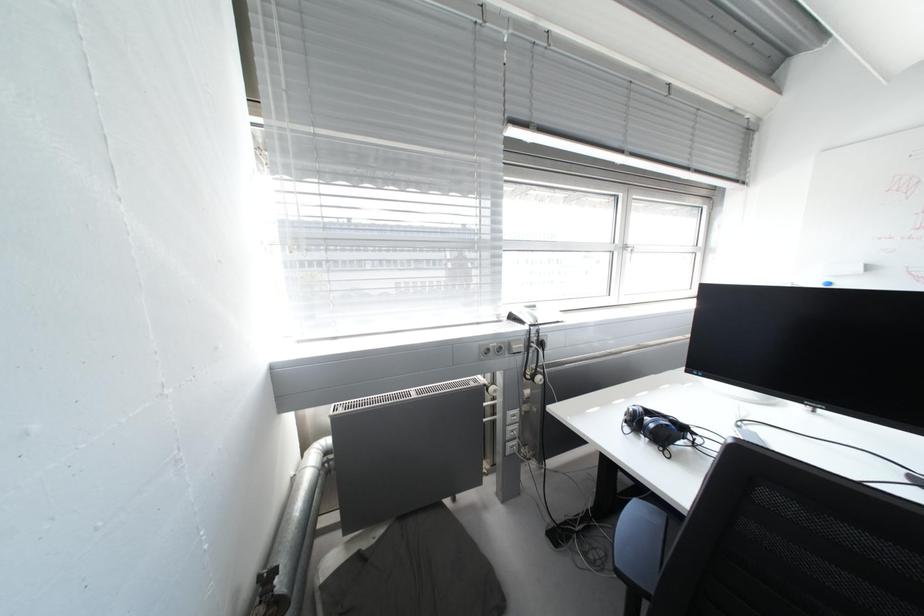
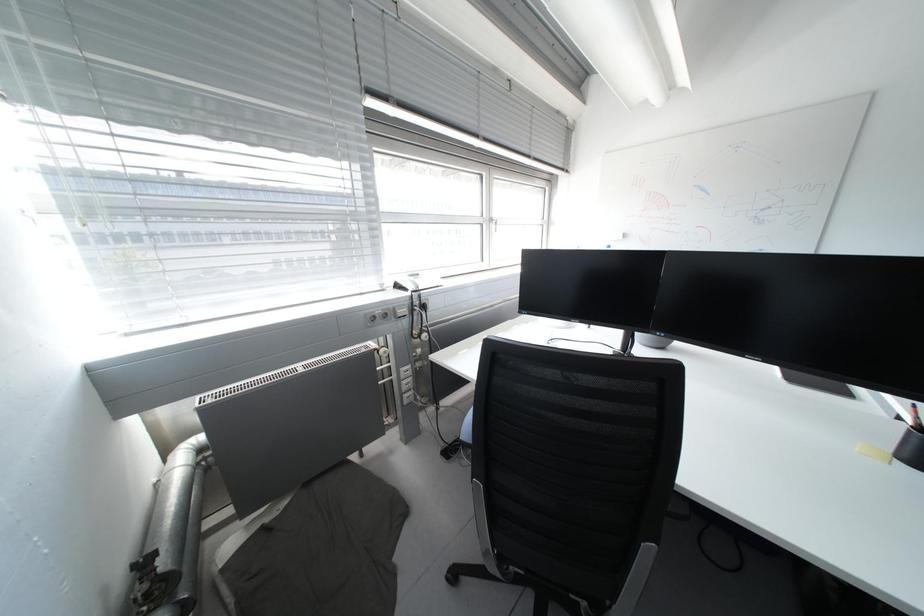
What movement of the cameraman would produce the second image?

The movement direction of the cameraman is right, backward.